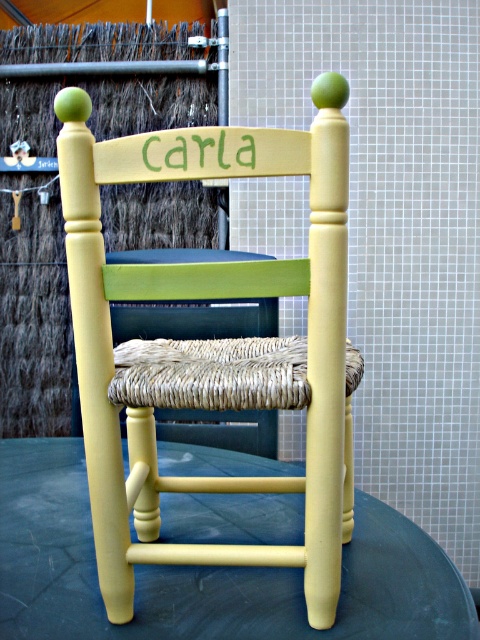
Question: Among these objects, which one is farthest from the camera?

Choices:
 (A) matte yellow wood chair at center
 (B) yellow painted wood round table at center

Answer: (B)

Question: Which point is farther to the camera?

Choices:
 (A) matte yellow wood chair at center
 (B) yellow painted wood round table at center

Answer: (B)

Question: Is matte yellow wood chair at center smaller than yellow painted wood round table at center?

Choices:
 (A) yes
 (B) no

Answer: (B)

Question: In this image, where is matte yellow wood chair at center located relative to yellow painted wood round table at center?

Choices:
 (A) right
 (B) left

Answer: (A)

Question: Does matte yellow wood chair at center appear on the right side of yellow painted wood round table at center?

Choices:
 (A) yes
 (B) no

Answer: (A)